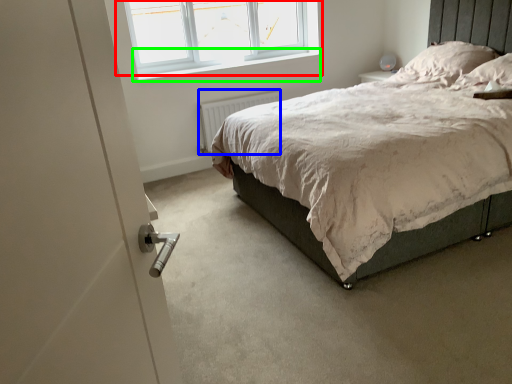
Question: Which object is the closest to the window (highlighted by a red box)? Choose among these: radiator (highlighted by a blue box) or window sill (highlighted by a green box).

Choices:
 (A) radiator
 (B) window sill

Answer: (B)